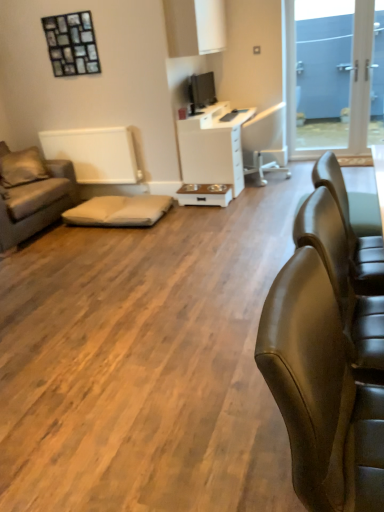
The height and width of the screenshot is (512, 384). What do you see at coordinates (265, 143) in the screenshot? I see `white plastic chair at center` at bounding box center [265, 143].

The width and height of the screenshot is (384, 512). Identify the location of leather couch at right, the 2th chair from the front. (352, 230).

How much space does leather couch at right, which appears as the 1th chair when viewed from the top, occupy horizontally?

The width of leather couch at right, which appears as the 1th chair when viewed from the top, is 29.74 inches.

What is the approximate height of blue glass door at upper right?

blue glass door at upper right is 5.93 feet tall.

You are a GUI agent. You are given a task and a screenshot of the screen. Output one action in this format:
    pyautogui.click(x=<x>, y=<y>)
    Task: Click on the beige fabric cushion at center
    
    Given the screenshot: What is the action you would take?
    pyautogui.click(x=119, y=211)

The image size is (384, 512). Describe the element at coordinates (119, 211) in the screenshot. I see `beige fabric cushion at center` at that location.

At what (x,y) coordinates should I click in order to perform the action: click on white plastic chair at center. Please return your answer as a coordinate pair (x, y). Image resolution: width=384 pixels, height=512 pixels. Looking at the image, I should click on (265, 143).

Is beige fabric cushion at center spatially inside beige fabric pillow at left, or outside of it?

beige fabric cushion at center cannot be found inside beige fabric pillow at left.

Is point (139, 211) closer to camera compared to point (22, 169)?

Yes.

From the image's perspective, which one is positioned higher, beige fabric cushion at center or beige fabric pillow at left?

From the image's view, beige fabric pillow at left is above.

This screenshot has width=384, height=512. Identify the location of pillow above the beige fabric cushion at center (from a real-world perspective). pos(22,167).

Consider the image. Is blue glass door at upper right positioned before leather couch at right, the 2th chair in the right-to-left sequence?

No, blue glass door at upper right is further to the viewer.

Measure the distance from blue glass door at upper right to leather couch at right, which is the 1th chair from bottom to top.

The distance of blue glass door at upper right from leather couch at right, which is the 1th chair from bottom to top, is 5.39 meters.

Which point is more distant from viewer, [322,53] or [371,431]?

The point [322,53] is farther from the camera.

Is blue glass door at upper right to the left of leather couch at right, which is the 1th chair from bottom to top, from the viewer's perspective?

No, blue glass door at upper right is not to the left of leather couch at right, which is the 1th chair from bottom to top.

Does brown fabric couch at left have a lesser width compared to beige fabric pillow at left?

Incorrect, the width of brown fabric couch at left is not less than that of beige fabric pillow at left.

From a real-world perspective, is brown fabric couch at left physically located above or below beige fabric pillow at left?

brown fabric couch at left is situated lower than beige fabric pillow at left in the real world.

Are brown fabric couch at left and beige fabric pillow at left beside each other?

No.

What's the angular difference between brown fabric couch at left and beige fabric pillow at left's facing directions?

The facing directions of brown fabric couch at left and beige fabric pillow at left are 44.8 degrees apart.

Are leather couch at right, arranged as the 1th chair when viewed from the left, and white plastic chair at center located far from each other?

Yes, leather couch at right, arranged as the 1th chair when viewed from the left, and white plastic chair at center are quite far apart.

Is leather couch at right, placed as the second chair when sorted from top to bottom, inside or outside of white plastic chair at center?

leather couch at right, placed as the second chair when sorted from top to bottom, cannot be found inside white plastic chair at center.

From a real-world perspective, is leather couch at right, acting as the 1th chair starting from the front, beneath white plastic chair at center?

Actually, leather couch at right, acting as the 1th chair starting from the front, is physically above white plastic chair at center in the real world.

From the image's perspective, between leather couch at right, placed as the second chair when sorted from top to bottom, and white plastic chair at center, which one is located above?

white plastic chair at center.

This screenshot has width=384, height=512. In order to click on table below the white glossy desk at center (from the image's perspective) in this screenshot , I will do `click(205, 194)`.

Could you tell me if white glossy table at center is facing white glossy desk at center?

No, white glossy table at center does not turn towards white glossy desk at center.

Is white glossy table at center taller or shorter than white glossy desk at center?

Clearly, white glossy table at center is shorter compared to white glossy desk at center.

Which is closer, [186,194] or [206,162]?

The point [206,162] is in front.

Which object is further away from the camera taking this photo, leather couch at right, the 2th chair viewed from the left, or leather couch at right, arranged as the 1th chair when viewed from the left?

leather couch at right, the 2th chair viewed from the left, is further from the camera.

From the image's perspective, which is above, leather couch at right, which is the 1th chair in back-to-front order, or leather couch at right, arranged as the 1th chair when viewed from the left?

leather couch at right, which is the 1th chair in back-to-front order.

Is leather couch at right, which appears as the 1th chair when viewed from the top, next to leather couch at right, acting as the 1th chair starting from the front?

leather couch at right, which appears as the 1th chair when viewed from the top, and leather couch at right, acting as the 1th chair starting from the front, are not in contact.

Can you tell me how much leather couch at right, which appears as the 1th chair when viewed from the top, and leather couch at right, the 2th chair in the right-to-left sequence, differ in facing direction?

The angle between the facing direction of leather couch at right, which appears as the 1th chair when viewed from the top, and the facing direction of leather couch at right, the 2th chair in the right-to-left sequence, is 177 degrees.

From the image's perspective, is leather couch at right, the second chair when ordered from bottom to top, below brown fabric couch at left?

Indeed, from the image's perspective, leather couch at right, the second chair when ordered from bottom to top, is shown beneath brown fabric couch at left.

Can you see leather couch at right, which is the 1th chair in back-to-front order, touching brown fabric couch at left?

They are not placed beside each other.

Is leather couch at right, the 2th chair viewed from the left, oriented away from brown fabric couch at left?

No, leather couch at right, the 2th chair viewed from the left, is not facing away from brown fabric couch at left.

What are the coordinates of `pillow located behind the beige fabric cushion at center` in the screenshot? It's located at (22, 167).

Image resolution: width=384 pixels, height=512 pixels. Identify the location of chair that is the 2nd one when counting forward from the blue glass door at upper right. (x=320, y=392).

When comparing their distances from white glossy table at center, does beige fabric cushion at center or beige fabric pillow at left seem further?

beige fabric pillow at left is further to white glossy table at center.

Considering their positions, is matte black tv at upper center positioned further to leather couch at right, arranged as the 1th chair when viewed from the left, than blue glass door at upper right?

The object further to leather couch at right, arranged as the 1th chair when viewed from the left, is blue glass door at upper right.

Looking at the image, which one is located further to blue glass door at upper right, leather couch at right, placed as the second chair when sorted from top to bottom, or matte black tv at upper center?

Based on the image, leather couch at right, placed as the second chair when sorted from top to bottom, appears to be further to blue glass door at upper right.

Considering their positions, is blue glass door at upper right positioned closer to beige fabric pillow at left than matte black tv at upper center?

Among the two, matte black tv at upper center is located nearer to beige fabric pillow at left.

Considering their positions, is blue glass door at upper right positioned closer to white glossy table at center than brown fabric couch at left?

Among the two, brown fabric couch at left is located nearer to white glossy table at center.

Based on their spatial positions, is white glossy table at center or beige fabric cushion at center closer to brown fabric couch at left?

beige fabric cushion at center is closer to brown fabric couch at left.

Estimate the real-world distances between objects in this image. Which object is further from leather couch at right, acting as the 1th chair starting from the front, brown fabric couch at left or beige fabric pillow at left?

The object further to leather couch at right, acting as the 1th chair starting from the front, is beige fabric pillow at left.

Based on their spatial positions, is beige fabric cushion at center or leather couch at right, which appears as the 1th chair when viewed from the top, closer to blue glass door at upper right?

beige fabric cushion at center.

Locate an element on the screen. pillow between brown fabric couch at left and blue glass door at upper right from left to right is located at coordinates (22, 167).

This screenshot has width=384, height=512. I want to click on armchair located between matte black tv at upper center and blue glass door at upper right in the left-right direction, so click(265, 143).

I want to click on studio couch between leather couch at right, which ranks as the 2th chair in back-to-front order, and matte black tv at upper center, along the z-axis, so click(36, 203).

Image resolution: width=384 pixels, height=512 pixels. Find the location of `table situated between brown fabric couch at left and leather couch at right, the second chair when ordered from bottom to top, from left to right`. table situated between brown fabric couch at left and leather couch at right, the second chair when ordered from bottom to top, from left to right is located at coordinates (205, 194).